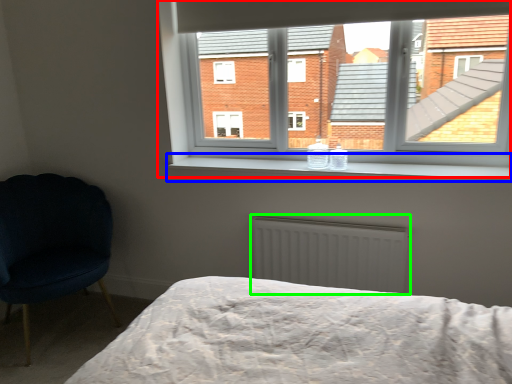
Question: Which object is the closest to the window (highlighted by a red box)? Choose among these: window sill (highlighted by a blue box) or radiator (highlighted by a green box).

Choices:
 (A) window sill
 (B) radiator

Answer: (A)